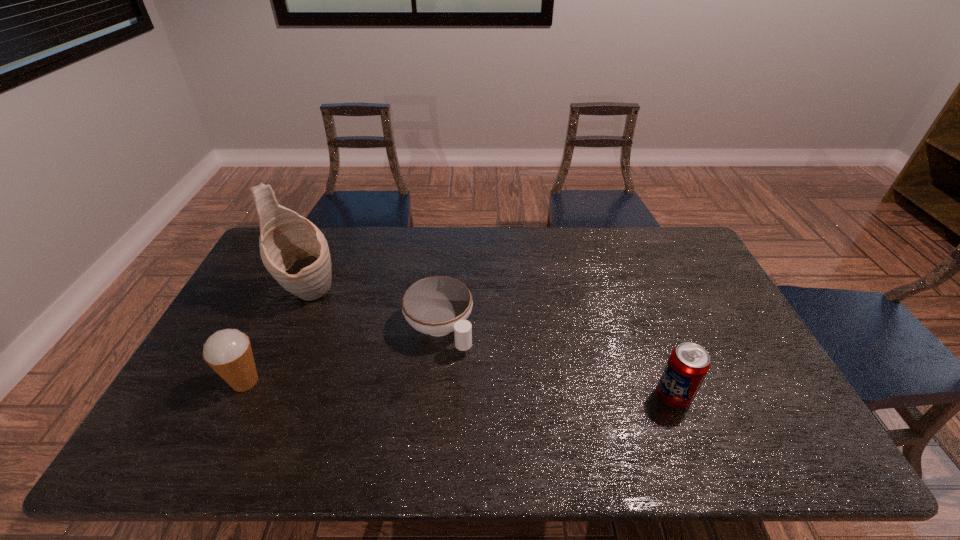
Where is `icecream`? icecream is located at coordinates (228, 352).

This screenshot has width=960, height=540. I want to click on soda can, so click(x=688, y=364).

The width and height of the screenshot is (960, 540). I want to click on the third object from left to right, so click(x=438, y=305).

This screenshot has height=540, width=960. Identify the location of chinaware. point(438,305).

This screenshot has height=540, width=960. I want to click on the tallest object, so click(x=295, y=252).

Where is `vacant space located 0.150m on the right of the icecream`? vacant space located 0.150m on the right of the icecream is located at coordinates (323, 381).

The image size is (960, 540). I want to click on free point located 0.130m on the right of the rightmost object, so click(741, 396).

Where is `free point located 0.220m on the side with the handle of the second object from right to left`? free point located 0.220m on the side with the handle of the second object from right to left is located at coordinates (506, 410).

You are a GUI agent. You are given a task and a screenshot of the screen. Output one action in this format:
    pyautogui.click(x=<x>, y=<y>)
    Task: Click on the free location located 0.260m on the side with the handle of the second object from right to left
    The width and height of the screenshot is (960, 540).
    Given the screenshot: What is the action you would take?
    pyautogui.click(x=516, y=422)

Locate an element on the screen. vacant space located 0.200m on the side with the handle of the second object from right to left is located at coordinates (501, 404).